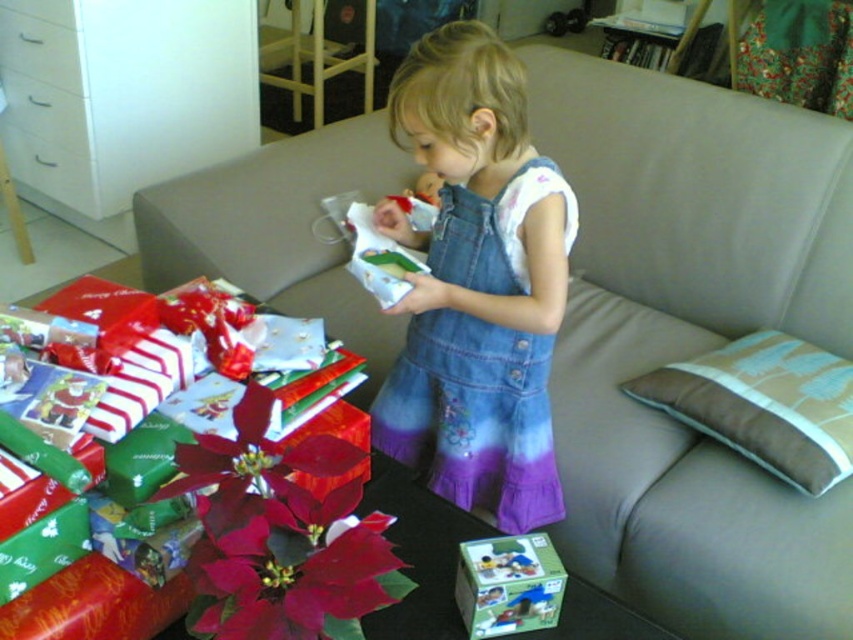
You are a photographer trying to capture the child unwrapping the gift. You want to ensure the denim dress at center and the green cardboard box at lower center are both visible in the frame. Based on their positions, which object should you focus on first to include both in the shot?

The denim dress at center is located above the green cardboard box at lower center, so focusing on the denim dress at center first will ensure both objects are within the frame since it is positioned higher up.

You are a photographer taking a picture of the scene. You notice two points in the image labeled as point (x=381, y=444) and point (x=474, y=564). Which point is closer to the camera?

Point (x=381, y=444) is further to the camera than point (x=474, y=564), so point (x=381, y=444) is closer to the camera.